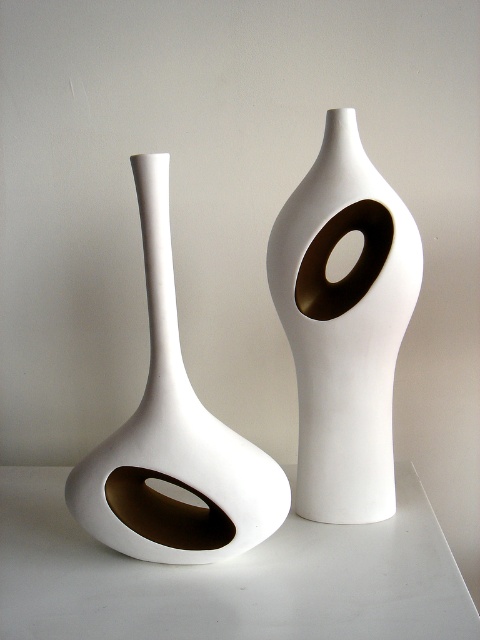
Question: Does white matte table at lower left have a smaller size compared to matte gold ring at center?

Choices:
 (A) no
 (B) yes

Answer: (A)

Question: Does white glossy vase at center appear on the right side of matte gold ring at center?

Choices:
 (A) yes
 (B) no

Answer: (B)

Question: Considering the real-world distances, which object is closest to the white glossy vase at center?

Choices:
 (A) white matte vase at left
 (B) white matte table at lower left

Answer: (A)

Question: Which point is farther from the camera taking this photo?

Choices:
 (A) (147, 580)
 (B) (386, 372)
 (C) (84, 506)
 (D) (377, 221)

Answer: (B)

Question: Which point appears farthest from the camera in this image?

Choices:
 (A) (368, 275)
 (B) (335, 352)
 (C) (264, 465)
 (D) (39, 582)

Answer: (A)

Question: Does white matte vase at left appear on the left side of matte gold ring at center?

Choices:
 (A) yes
 (B) no

Answer: (A)